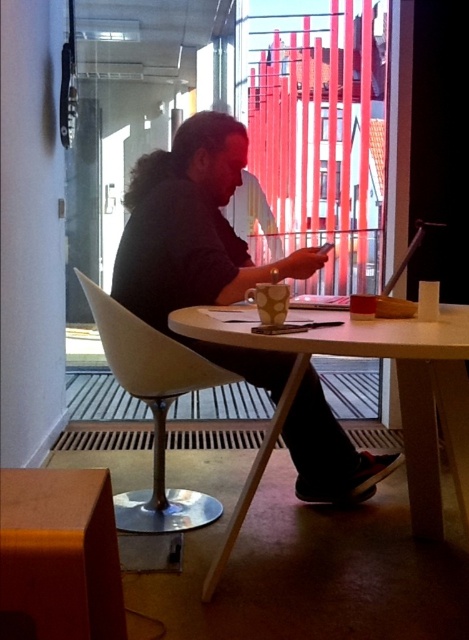
Question: Estimate the real-world distances between objects in this image. Which object is closer to the matte white chair at center?

Choices:
 (A) white wood table at center
 (B) dark gray hoodie at center

Answer: (B)

Question: Can you confirm if dark gray hoodie at center is positioned above matte white chair at center?

Choices:
 (A) no
 (B) yes

Answer: (B)

Question: Which of the following is the closest to the observer?

Choices:
 (A) (186, 385)
 (B) (234, 184)

Answer: (A)

Question: Can you confirm if dark gray hoodie at center is smaller than white wood table at center?

Choices:
 (A) no
 (B) yes

Answer: (A)

Question: Is white wood table at center below matte white chair at center?

Choices:
 (A) no
 (B) yes

Answer: (B)

Question: Which point is closer to the camera?

Choices:
 (A) (178, 237)
 (B) (143, 348)

Answer: (A)